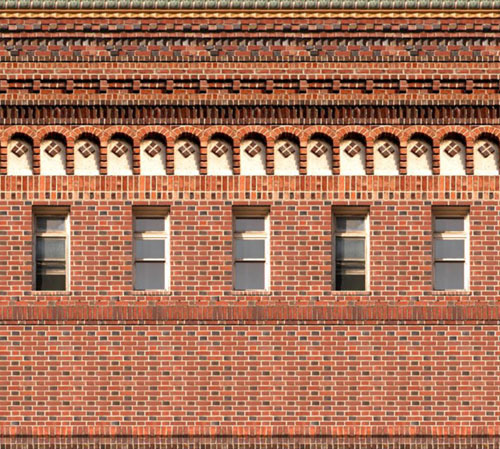
Where is `first window on right`? The width and height of the screenshot is (500, 449). first window on right is located at coordinates (455, 272).